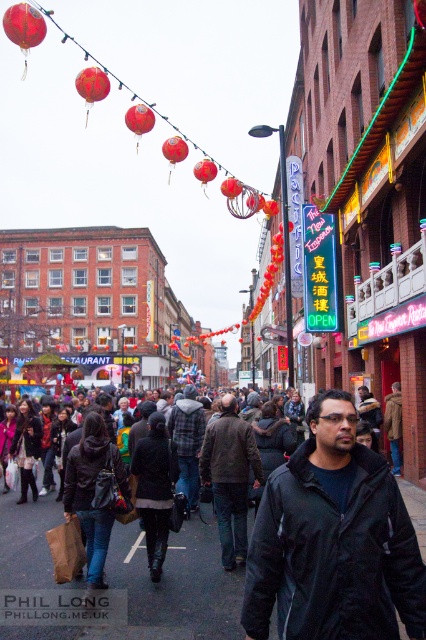
Consider the image. Is the position of red glossy lantern at upper left less distant than that of red paper lantern at center?

Yes, red glossy lantern at upper left is in front of red paper lantern at center.

Who is positioned more to the left, red glossy lantern at upper left or red paper lantern at center?

Positioned to the left is red glossy lantern at upper left.

Find the location of a particular element. Image resolution: width=426 pixels, height=640 pixels. red glossy lantern at upper left is located at coordinates (23, 28).

Between black leather jacket at center and matte red lantern at upper center, which one appears on the right side from the viewer's perspective?

Positioned to the right is black leather jacket at center.

Which of these two, black leather jacket at center or matte red lantern at upper center, stands taller?

matte red lantern at upper center is taller.

Image resolution: width=426 pixels, height=640 pixels. What do you see at coordinates (155, 488) in the screenshot?
I see `black leather jacket at center` at bounding box center [155, 488].

This screenshot has width=426, height=640. Identify the location of black leather jacket at center. (155, 488).

Who is positioned more to the right, red matte lantern at upper center or red glossy lantern at center?

Positioned to the right is red glossy lantern at center.

Does red matte lantern at upper center appear on the right side of red glossy lantern at center?

In fact, red matte lantern at upper center is to the left of red glossy lantern at center.

The image size is (426, 640). I want to click on red matte lantern at upper center, so click(x=92, y=86).